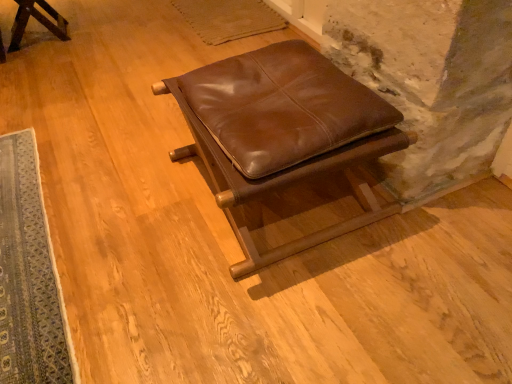
Find the location of a particular element. The height and width of the screenshot is (384, 512). vacant area that lies to the right of blue woven rug at lower left is located at coordinates (181, 242).